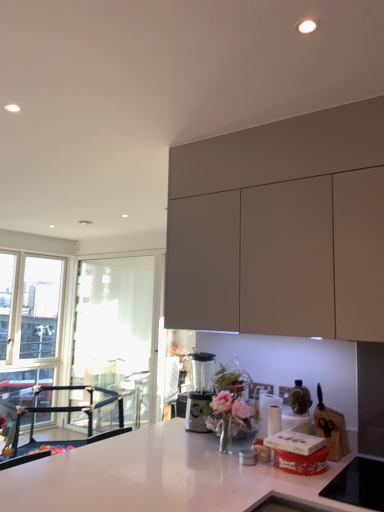
Question: Is white glossy countertop at center positioned before sleek metallic blender at center?

Choices:
 (A) no
 (B) yes

Answer: (B)

Question: Is sleek metallic blender at center located within white glossy countertop at center?

Choices:
 (A) no
 (B) yes

Answer: (A)

Question: Does white glossy countertop at center have a lesser width compared to sleek metallic blender at center?

Choices:
 (A) yes
 (B) no

Answer: (B)

Question: Is white glossy countertop at center aimed at sleek metallic blender at center?

Choices:
 (A) yes
 (B) no

Answer: (B)

Question: Is white glossy countertop at center not close to sleek metallic blender at center?

Choices:
 (A) yes
 (B) no

Answer: (B)

Question: Is white glossy countertop at center shorter than sleek metallic blender at center?

Choices:
 (A) yes
 (B) no

Answer: (B)

Question: From the image's perspective, is shiny metallic bottle at center located above matte gray cabinet at upper right?

Choices:
 (A) no
 (B) yes

Answer: (A)

Question: Is shiny metallic bottle at center smaller than matte gray cabinet at upper right?

Choices:
 (A) no
 (B) yes

Answer: (B)

Question: Is shiny metallic bottle at center further to camera compared to matte gray cabinet at upper right?

Choices:
 (A) yes
 (B) no

Answer: (A)

Question: Can you confirm if shiny metallic bottle at center is thinner than matte gray cabinet at upper right?

Choices:
 (A) yes
 (B) no

Answer: (A)

Question: Considering the relative positions of shiny metallic bottle at center and matte gray cabinet at upper right in the image provided, is shiny metallic bottle at center to the right of matte gray cabinet at upper right from the viewer's perspective?

Choices:
 (A) yes
 (B) no

Answer: (A)

Question: From a real-world perspective, is shiny metallic bottle at center positioned under matte gray cabinet at upper right based on gravity?

Choices:
 (A) no
 (B) yes

Answer: (B)

Question: Considering the relative sizes of transparent glass window screen at left and matte gray cabinet at upper right in the image provided, is transparent glass window screen at left wider than matte gray cabinet at upper right?

Choices:
 (A) yes
 (B) no

Answer: (B)